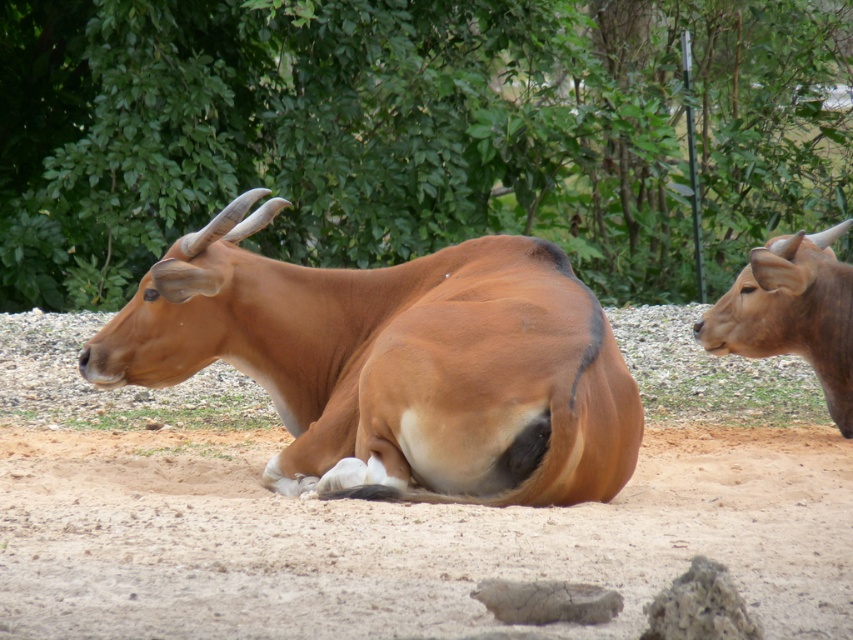
Question: Among these objects, which one is nearest to the camera?

Choices:
 (A) brown matte bull at right
 (B) brown smooth cow at center

Answer: (B)

Question: Which of these objects is positioned farthest from the brown matte bull at right?

Choices:
 (A) green leafy tree at upper center
 (B) brown smooth cow at center

Answer: (A)

Question: Is brown smooth cow at center wider than brown matte bull at right?

Choices:
 (A) no
 (B) yes

Answer: (B)

Question: Which point appears farthest from the camera in this image?

Choices:
 (A) (76, 60)
 (B) (224, 346)
 (C) (792, 332)

Answer: (A)

Question: Does brown smooth cow at center have a larger size compared to brown matte bull at right?

Choices:
 (A) yes
 (B) no

Answer: (A)

Question: Is brown smooth cow at center positioned behind brown matte bull at right?

Choices:
 (A) yes
 (B) no

Answer: (B)